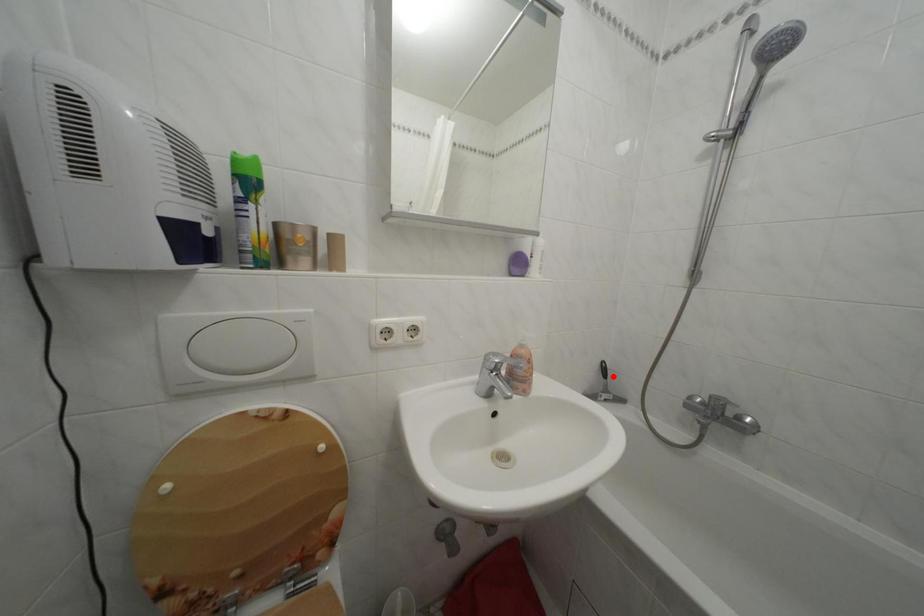
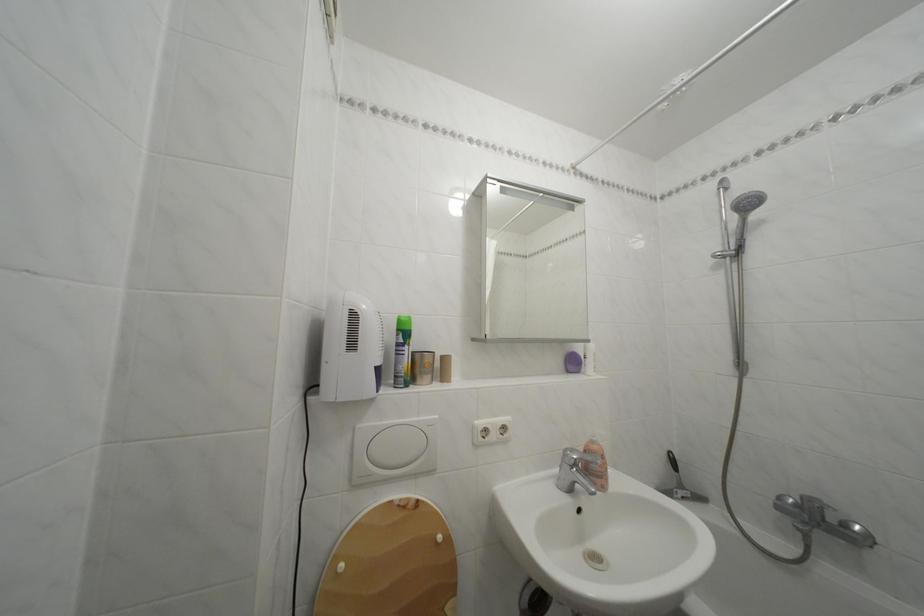
Find the pixel in the second image that matches the highlighted location in the first image.

(682, 468)